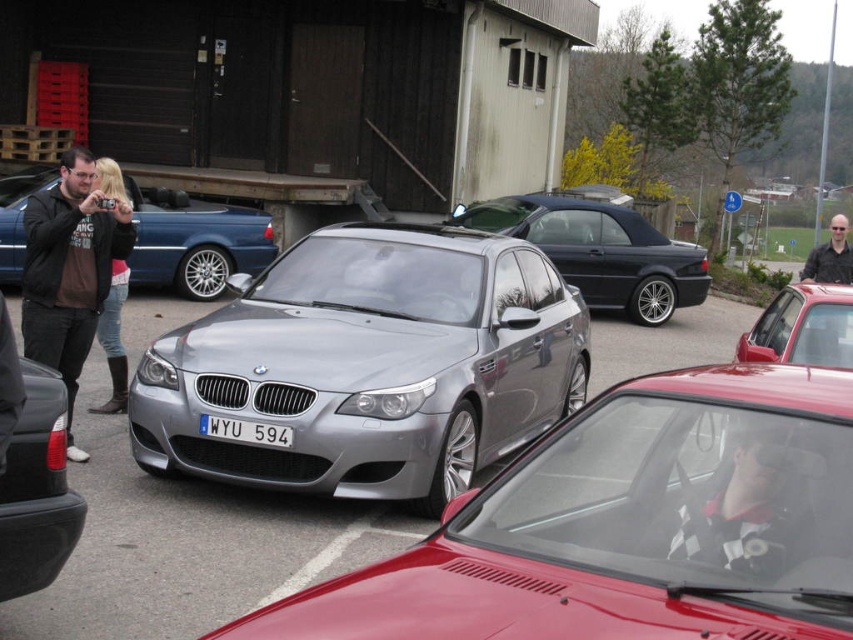
You are a photographer standing at the back of the scene. You want to take a photo that includes both the satin silver car at center and the satin silver metallic sedan at left. Which car should you position closer to the camera to ensure both are fully visible in the frame?

The satin silver car at center is below the satin silver metallic sedan at left. To include both in the frame, position the satin silver metallic sedan at left closer to the camera since it is higher up and the lower car might be blocked.

You are standing at the back of the scene and want to take a photo of the satin silver metallic sedan at center without including the matte black jacket at left in the frame. Is the position of the sedan below the jacket helpful for this purpose?

Yes, since the satin silver metallic sedan at center is located below the matte black jacket at left, positioning yourself lower or adjusting the angle so the jacket is above and out of the frame would allow capturing the sedan without the jacket.